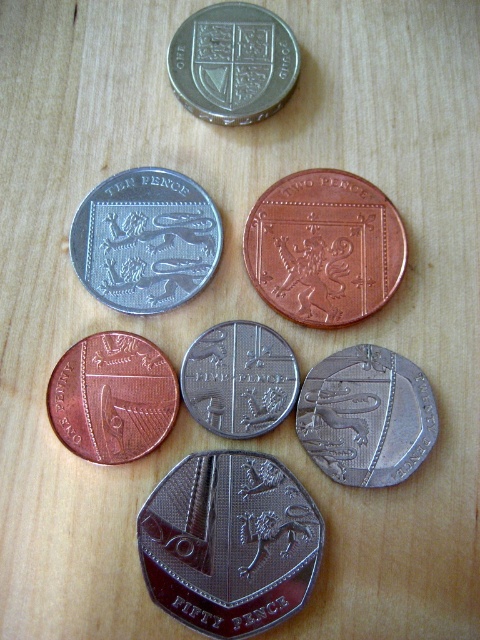
Question: Based on their relative distances, which object is farther from the copper metallic coin at lower left?

Choices:
 (A) copper metallic coin at center
 (B) silver metallic coin at center

Answer: (A)

Question: Does copper metallic coin at center have a greater width compared to matte silver coin at upper center?

Choices:
 (A) no
 (B) yes

Answer: (B)

Question: Which point appears closest to the camera in this image?

Choices:
 (A) (386, 225)
 (B) (101, 413)
 (C) (210, 196)

Answer: (B)

Question: From the image, what is the correct spatial relationship of copper metallic coin at center in relation to matte silver coin at upper center?

Choices:
 (A) right
 (B) left

Answer: (A)

Question: Does copper metallic coin at lower left have a greater width compared to matte silver coin at upper center?

Choices:
 (A) no
 (B) yes

Answer: (A)

Question: Which object is farther from the camera taking this photo?

Choices:
 (A) copper metallic coin at lower left
 (B) satin silver coin at center

Answer: (A)